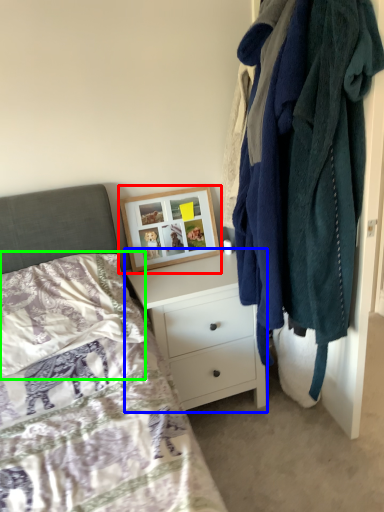
Question: Estimate the real-world distances between objects in this image. Which object is closer to picture frame (highlighted by a red box), chest of drawers (highlighted by a blue box) or pillow (highlighted by a green box)?

Choices:
 (A) chest of drawers
 (B) pillow

Answer: (A)